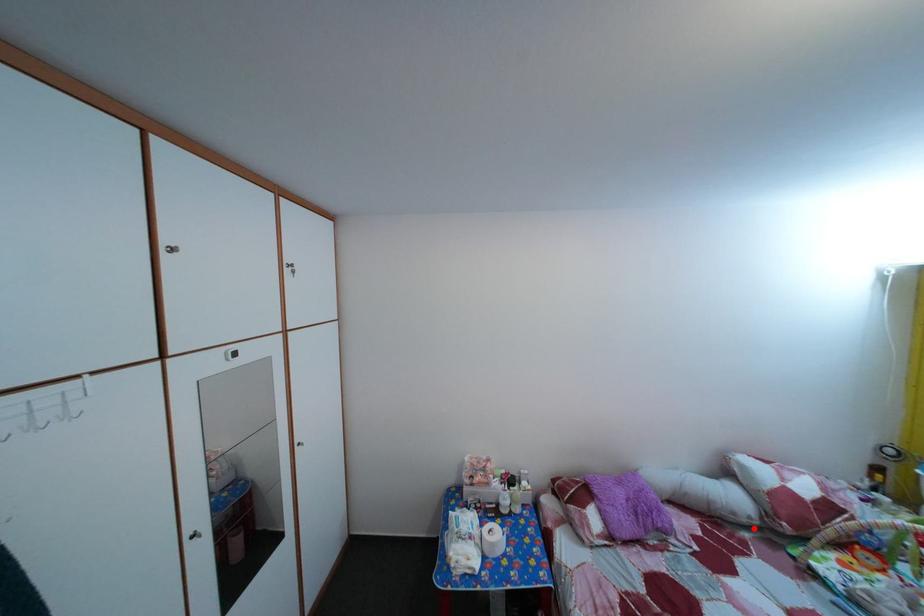
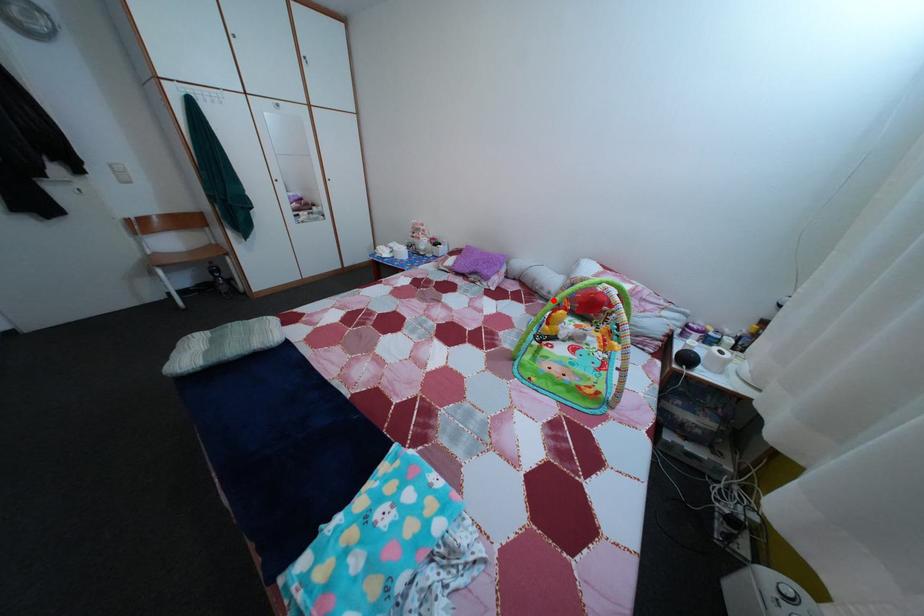
I am providing you with two images of the same scene from different viewpoints. A red point is marked on the first image and another point is marked on the second image. Is the marked point in image1 the same physical position as the marked point in image2?

Yes